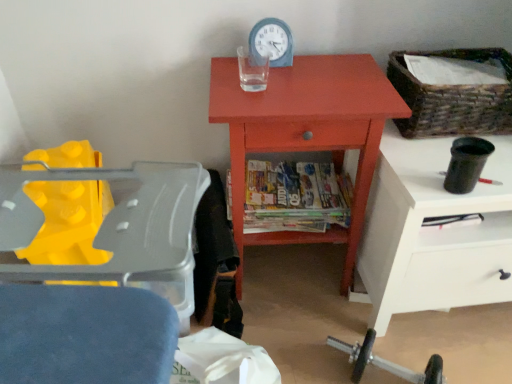
Question: From their relative heights in the image, would you say woven brown basket at upper right is taller or shorter than blue plastic clock at upper center?

Choices:
 (A) tall
 (B) short

Answer: (A)

Question: From the image's perspective, is woven brown basket at upper right located above or below blue plastic clock at upper center?

Choices:
 (A) above
 (B) below

Answer: (B)

Question: Which of these objects is positioned closest to the multicolored glossy magazines at center?

Choices:
 (A) white glossy nightstand at right
 (B) blue plastic clock at upper center
 (C) matte orange cabinet at center
 (D) woven brown basket at upper right

Answer: (C)

Question: Which object is positioned farthest from the blue plastic clock at upper center?

Choices:
 (A) multicolored glossy magazines at center
 (B) woven brown basket at upper right
 (C) white glossy nightstand at right
 (D) matte orange cabinet at center

Answer: (C)